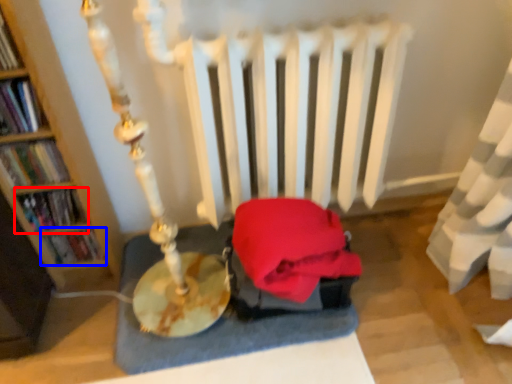
Question: Which point is further to the camera, book (highlighted by a red box) or book (highlighted by a blue box)?

Choices:
 (A) book
 (B) book

Answer: (B)